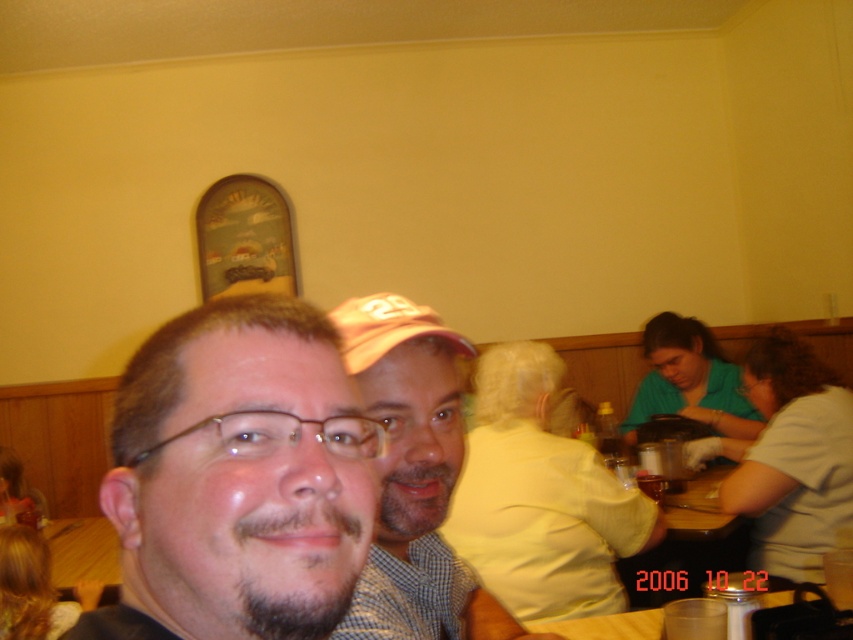
Question: Can you confirm if matte black shirt at left is positioned above checkered fabric shirt at center?

Choices:
 (A) no
 (B) yes

Answer: (B)

Question: Among these objects, which one is nearest to the camera?

Choices:
 (A) checkered fabric shirt at center
 (B) matte black shirt at left

Answer: (B)

Question: Is matte black shirt at left above checkered fabric shirt at center?

Choices:
 (A) no
 (B) yes

Answer: (B)

Question: Is matte black shirt at left in front of checkered fabric shirt at center?

Choices:
 (A) yes
 (B) no

Answer: (A)

Question: Which of the following is the closest to the observer?

Choices:
 (A) checkered fabric shirt at center
 (B) matte black shirt at left

Answer: (B)